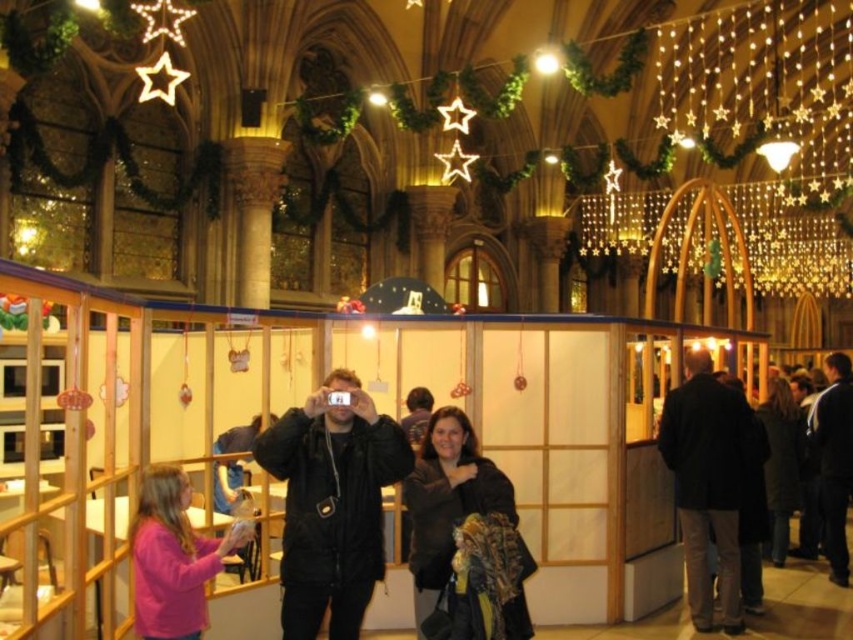
Measure the distance between dark brown leather jacket at center and dark brown leather jacket at right.

The distance of dark brown leather jacket at center from dark brown leather jacket at right is 22.13 meters.

Consider the image. Who is positioned more to the right, dark brown leather jacket at center or dark brown leather jacket at right?

dark brown leather jacket at right is more to the right.

Which is behind, point (460, 460) or point (788, 496)?

The point (788, 496) is more distant.

Where is `dark brown leather jacket at center`? The image size is (853, 640). dark brown leather jacket at center is located at coordinates (447, 500).

Between pink matte jacket at lower left and dark brown leather jacket at right, which one appears on the left side from the viewer's perspective?

pink matte jacket at lower left is more to the left.

From the picture: Measure the distance between point (x=229, y=529) and camera.

Point (x=229, y=529) and camera are 24.51 meters apart.

This screenshot has height=640, width=853. I want to click on pink matte jacket at lower left, so click(173, 557).

Can you confirm if dark brown leather jacket at center is thinner than pink matte jacket at lower left?

Yes, dark brown leather jacket at center is thinner than pink matte jacket at lower left.

Measure the distance between dark brown leather jacket at center and camera.

88.51 feet

Between point (422, 611) and point (140, 525), which one is positioned in front?

Point (140, 525)

Find the location of a particular element. dark brown leather jacket at center is located at coordinates (447, 500).